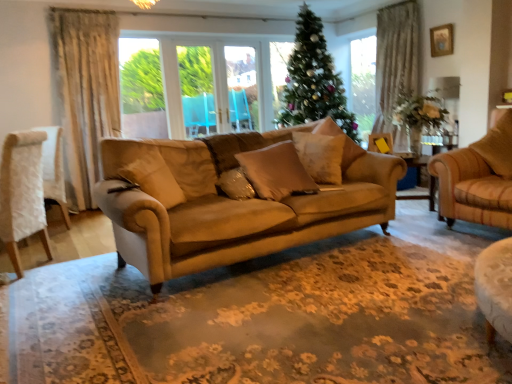
Question: Considering the relative sizes of white fabric chair at left and green metallic christmas tree at center in the image provided, is white fabric chair at left bigger than green metallic christmas tree at center?

Choices:
 (A) no
 (B) yes

Answer: (A)

Question: From a real-world perspective, is white fabric chair at left located higher than green metallic christmas tree at center?

Choices:
 (A) no
 (B) yes

Answer: (A)

Question: From the image's perspective, would you say white fabric chair at left is positioned over green metallic christmas tree at center?

Choices:
 (A) yes
 (B) no

Answer: (B)

Question: Is white fabric chair at left facing away from green metallic christmas tree at center?

Choices:
 (A) no
 (B) yes

Answer: (A)

Question: Is white fabric chair at left positioned before green metallic christmas tree at center?

Choices:
 (A) no
 (B) yes

Answer: (B)

Question: Is white fabric chair at left facing towards green metallic christmas tree at center?

Choices:
 (A) yes
 (B) no

Answer: (B)

Question: Is green metallic christmas tree at center outside of suede-like beige pillow at center, the fifth pillow in the left-to-right sequence?

Choices:
 (A) yes
 (B) no

Answer: (A)

Question: Can you confirm if green metallic christmas tree at center is thinner than suede-like beige pillow at center, acting as the 2th pillow starting from the right?

Choices:
 (A) no
 (B) yes

Answer: (A)

Question: From a real-world perspective, is green metallic christmas tree at center positioned under suede-like beige pillow at center, acting as the 2th pillow starting from the right, based on gravity?

Choices:
 (A) no
 (B) yes

Answer: (A)

Question: Is green metallic christmas tree at center positioned before suede-like beige pillow at center, the fifth pillow in the left-to-right sequence?

Choices:
 (A) no
 (B) yes

Answer: (A)

Question: From a real-world perspective, does green metallic christmas tree at center stand above suede-like beige pillow at center, the fifth pillow in the left-to-right sequence?

Choices:
 (A) no
 (B) yes

Answer: (B)

Question: Considering the relative positions of green metallic christmas tree at center and suede-like beige pillow at center, acting as the 2th pillow starting from the right, in the image provided, is green metallic christmas tree at center to the right of suede-like beige pillow at center, acting as the 2th pillow starting from the right, from the viewer's perspective?

Choices:
 (A) no
 (B) yes

Answer: (B)

Question: Considering the relative sizes of white fabric chair at left and wooden picture frame at upper right in the image provided, is white fabric chair at left shorter than wooden picture frame at upper right?

Choices:
 (A) yes
 (B) no

Answer: (B)